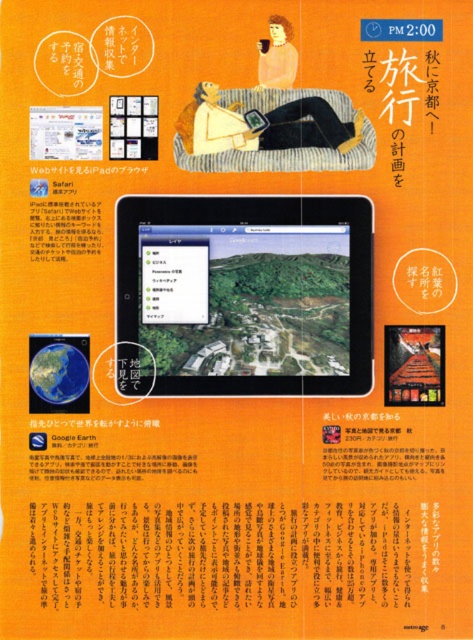
Question: Observing the image, what is the correct spatial positioning of black glossy tablet at center in reference to orange paper at upper center?

Choices:
 (A) right
 (B) left

Answer: (A)

Question: Is matte black tablet at center smaller than pastel yellow hair at upper center?

Choices:
 (A) no
 (B) yes

Answer: (A)

Question: Where is orange paper at upper center located in relation to pastel yellow hair at upper center in the image?

Choices:
 (A) below
 (B) above

Answer: (A)

Question: Which of these objects is positioned farthest from the pastel yellow hair at upper center?

Choices:
 (A) black glossy tablet at center
 (B) orange paper at upper center

Answer: (B)

Question: Which is nearer to the pastel yellow hair at upper center?

Choices:
 (A) matte black tablet at center
 (B) black glossy tablet at center
 (C) orange paper at upper center

Answer: (A)

Question: Estimate the real-world distances between objects in this image. Which object is closer to the black glossy tablet at center?

Choices:
 (A) orange paper at upper center
 (B) matte black tablet at center
 (C) pastel yellow hair at upper center

Answer: (B)